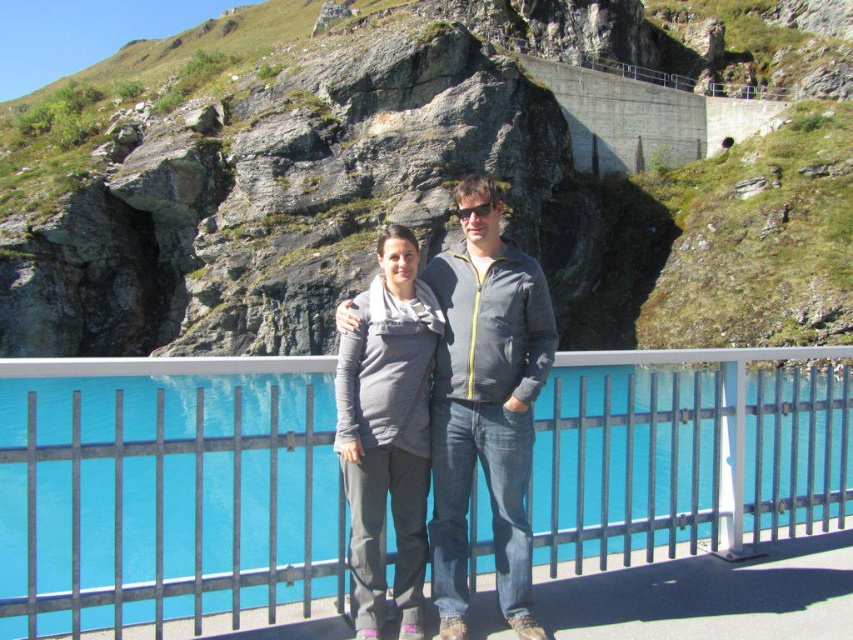
Is blue glass pool at center positioned in front of matte gray sweater at center?

Yes, it is in front of matte gray sweater at center.

In the scene shown: Who is positioned more to the left, blue glass pool at center or matte gray sweater at center?

blue glass pool at center is more to the left.

Identify the location of blue glass pool at center. (165, 492).

Can you confirm if rough stone hillside at upper center is taller than gray fabric sweater at center?

Correct, rough stone hillside at upper center is much taller as gray fabric sweater at center.

How far apart are rough stone hillside at upper center and gray fabric sweater at center?

The distance of rough stone hillside at upper center from gray fabric sweater at center is 38.70 meters.

Does point (93, 220) lie in front of point (440, 532)?

No.

Locate an element on the screen. The width and height of the screenshot is (853, 640). rough stone hillside at upper center is located at coordinates (432, 172).

Which is above, matte gray sweater at center or black plastic sunglasses at center?

black plastic sunglasses at center is higher up.

Between point (354, 509) and point (476, 211), which one is positioned behind?

Point (476, 211)

Where is `matte gray sweater at center`? This screenshot has height=640, width=853. matte gray sweater at center is located at coordinates (387, 432).